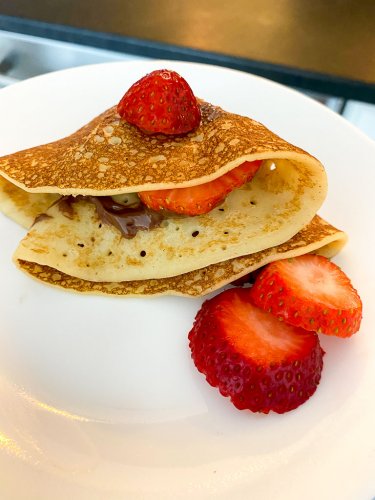
Locate an element on the screen. table is located at coordinates (242, 13).